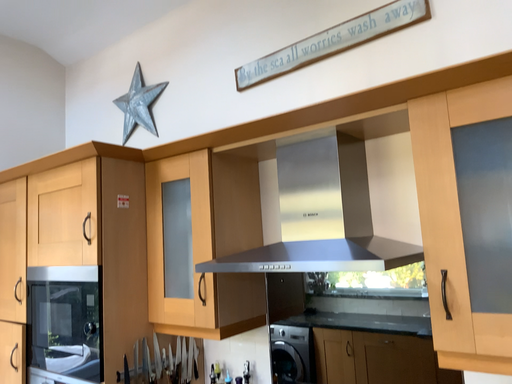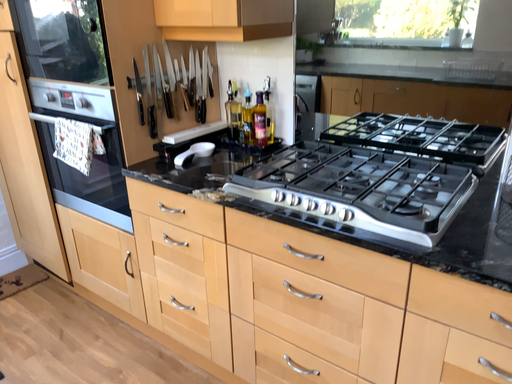
Question: How did the camera likely rotate when shooting the video?

Choices:
 (A) rotated upward
 (B) rotated downward

Answer: (B)